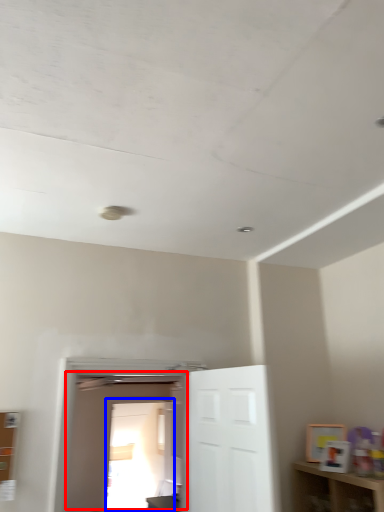
Question: Which point is closer to the camera, door (highlighted by a red box) or glass door (highlighted by a blue box)?

Choices:
 (A) door
 (B) glass door

Answer: (A)